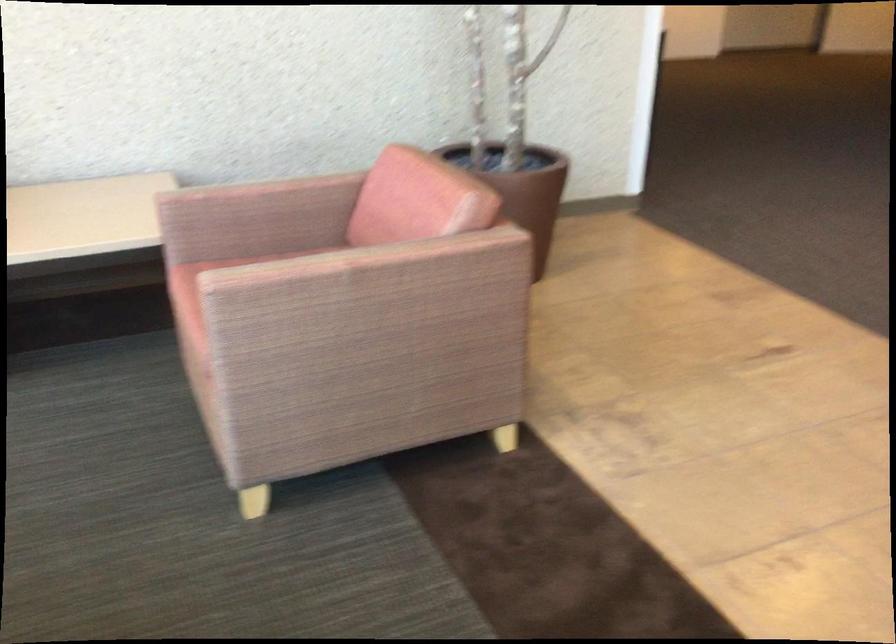
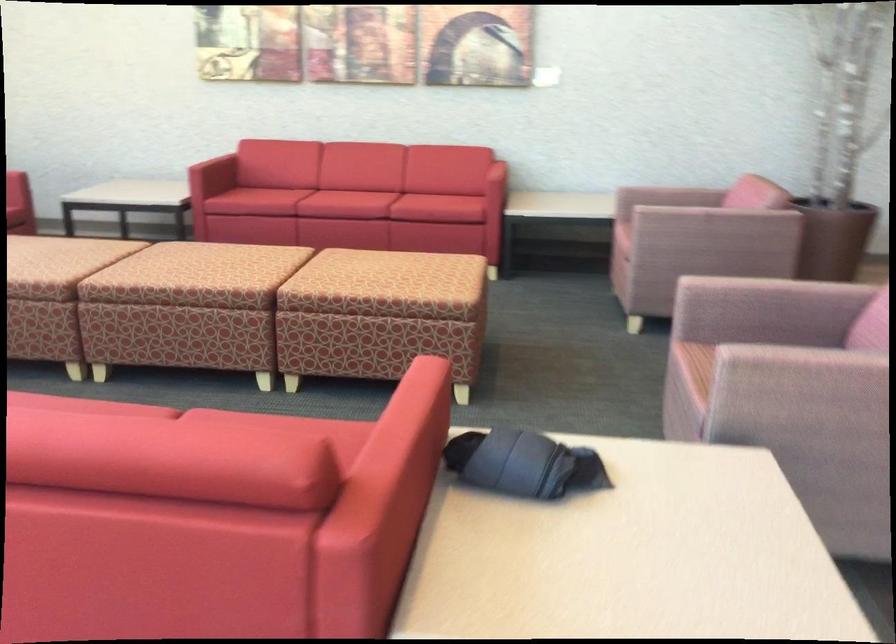
Question: The images are taken continuously from a first-person perspective. In which direction are you moving?

Choices:
 (A) Left
 (B) Right
 (C) Forward
 (D) Backward

Answer: (D)